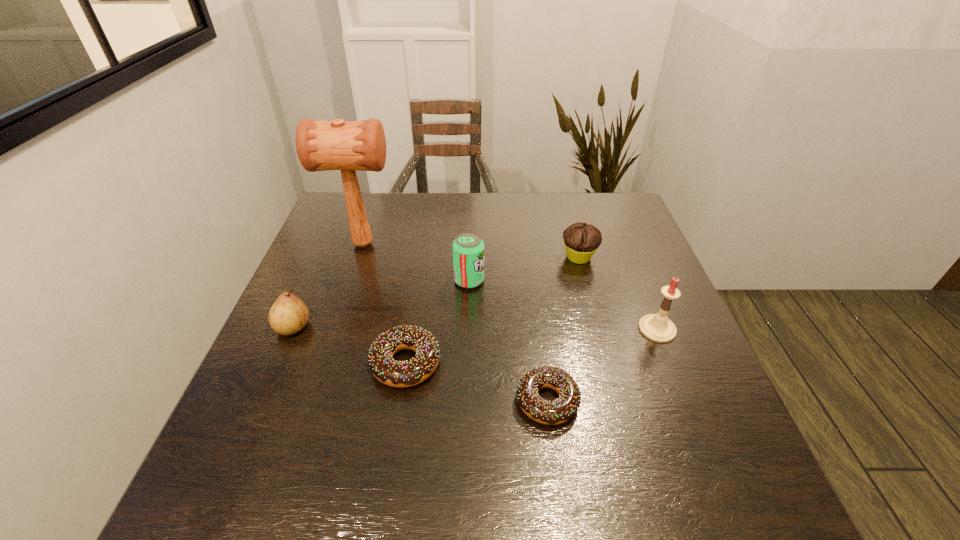
Image resolution: width=960 pixels, height=540 pixels. I want to click on vacant space in between the taller doughnut and the pear, so click(349, 345).

The image size is (960, 540). I want to click on unoccupied area between the sixth object from left to right and the candle, so click(x=618, y=293).

Locate an element on the screen. vacant space that's between the sixth tallest object and the pear is located at coordinates (349, 345).

Where is `free spot between the shortest object and the muffin`? free spot between the shortest object and the muffin is located at coordinates (563, 329).

Where is `free spot between the pear and the candle`? free spot between the pear and the candle is located at coordinates (475, 328).

This screenshot has height=540, width=960. What are the coordinates of `vacant area that lies between the rightmost object and the pear` in the screenshot? It's located at (475, 328).

The width and height of the screenshot is (960, 540). Find the location of `empty space that is in between the muffin and the shorter doughnut`. empty space that is in between the muffin and the shorter doughnut is located at coordinates (563, 329).

In order to click on vacant space in between the fifth shortest object and the mallet in this screenshot , I will do `click(417, 262)`.

Locate which object is the third closest to the fourth object from right to left. Please provide its 2D coordinates. Your answer should be formatted as a tuple, i.e. [(x, y)], where the tuple contains the x and y coordinates of a point satisfying the conditions above.

[(581, 241)]

The height and width of the screenshot is (540, 960). I want to click on object that ranks as the closest to the pear, so click(408, 373).